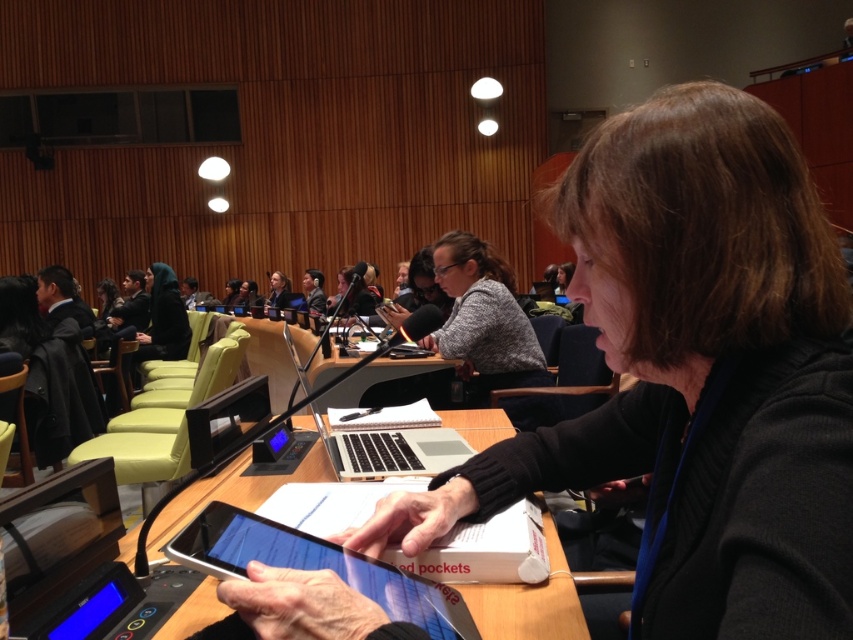
Question: Which of the following is the closest to the observer?

Choices:
 (A) (310, 566)
 (B) (369, 440)
 (C) (318, 307)
 (D) (223, 609)

Answer: (A)

Question: Where is dark suit at left located in relation to matte black laptop at center in the image?

Choices:
 (A) above
 (B) below

Answer: (B)

Question: Is dark gray fabric hijab at center bigger than dark gray suit at center?

Choices:
 (A) yes
 (B) no

Answer: (A)

Question: Does silver/black matte laptop at center have a smaller size compared to dark gray suit at center?

Choices:
 (A) yes
 (B) no

Answer: (A)

Question: Which point is closer to the camera?

Choices:
 (A) coord(157,314)
 (B) coord(286,538)
 (C) coord(225,288)

Answer: (B)

Question: Which point is closer to the camera taking this photo?

Choices:
 (A) [474, 394]
 (B) [236, 284]

Answer: (A)